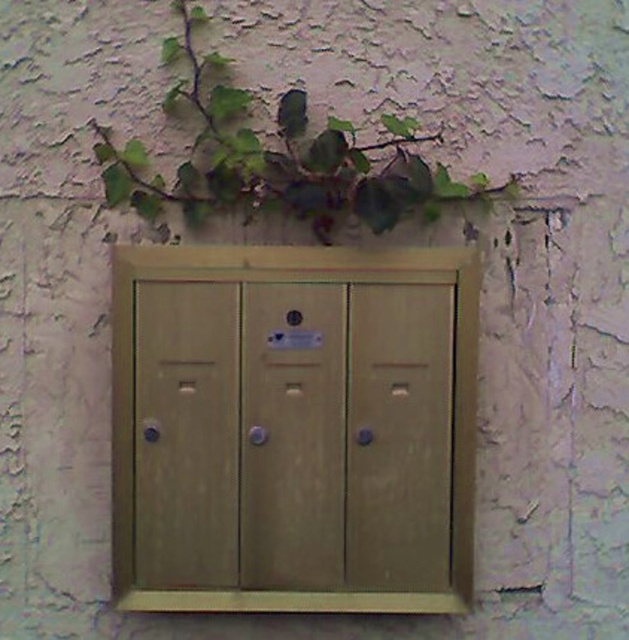
Is wooden locker at center in front of green leafy plant at upper center?

No.

Is wooden locker at center below green leafy plant at upper center?

Yes, wooden locker at center is below green leafy plant at upper center.

This screenshot has width=629, height=640. What do you see at coordinates (292, 428) in the screenshot?
I see `wooden locker at center` at bounding box center [292, 428].

The height and width of the screenshot is (640, 629). Identify the location of wooden locker at center. (292, 428).